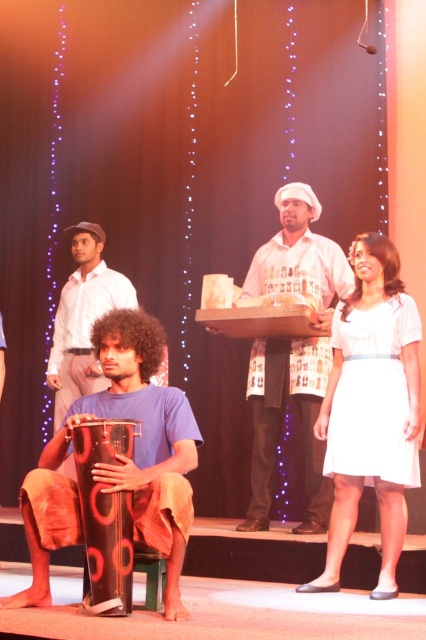
From the picture: Is white cotton dress at center positioned in front of white printed shirt at center?

Result: Yes, it is in front of white printed shirt at center.

Is white cotton dress at center positioned at the back of white printed shirt at center?

No, white cotton dress at center is closer to the viewer.

Is point (359, 236) more distant than point (307, 342)?

No, (359, 236) is in front of (307, 342).

Locate an element on the screen. This screenshot has height=640, width=426. white cotton dress at center is located at coordinates (371, 408).

Consider the image. Is black matte drum at lower left shorter than black plastic drum at lower left?

Incorrect, black matte drum at lower left's height does not fall short of black plastic drum at lower left's.

Does black matte drum at lower left have a larger size compared to black plastic drum at lower left?

Yes.

Image resolution: width=426 pixels, height=640 pixels. What are the coordinates of `black matte drum at lower left` in the screenshot? It's located at (120, 460).

Is white cotton dress at center bigger than black plastic drum at lower left?

Indeed, white cotton dress at center has a larger size compared to black plastic drum at lower left.

Who is positioned more to the right, white cotton dress at center or black plastic drum at lower left?

white cotton dress at center is more to the right.

Locate an element on the screen. The image size is (426, 640). white cotton dress at center is located at coordinates (371, 408).

This screenshot has width=426, height=640. What are the coordinates of `white cotton dress at center` in the screenshot? It's located at (371, 408).